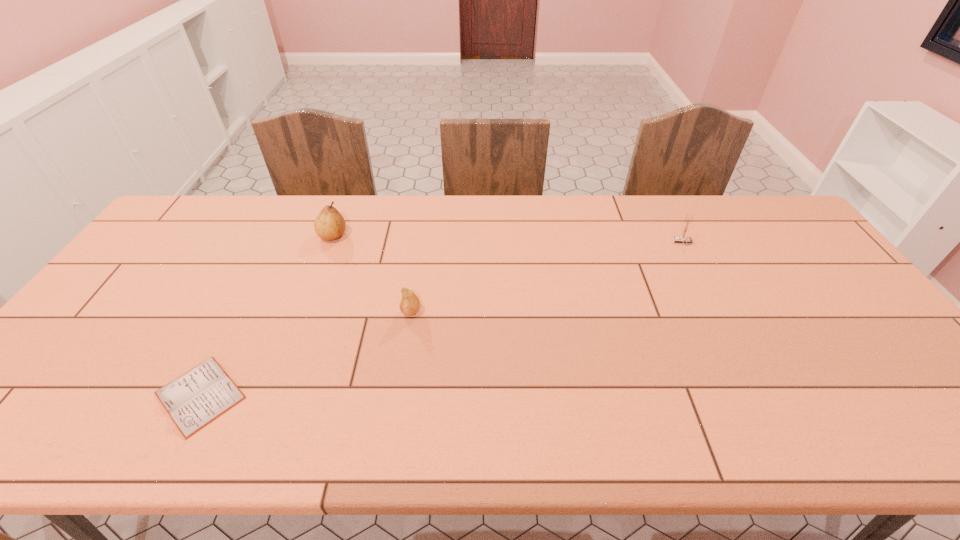
Find the location of a particular element. The width and height of the screenshot is (960, 540). free spot between the second object from right to left and the matchbox is located at coordinates (546, 276).

The width and height of the screenshot is (960, 540). Identify the location of empty space that is in between the matchbox and the diary. (442, 319).

Find the location of a particular element. The image size is (960, 540). free spot between the rightmost object and the nearer pear is located at coordinates (546, 276).

You are a GUI agent. You are given a task and a screenshot of the screen. Output one action in this format:
    pyautogui.click(x=<x>, y=<y>)
    Task: Click on the free space between the matchbox and the farther pear
    
    Given the screenshot: What is the action you would take?
    pyautogui.click(x=508, y=239)

Locate an element on the screen. The image size is (960, 540). vacant region between the matchbox and the shorter pear is located at coordinates (546, 276).

Where is `empty location between the shortest object and the matchbox`? This screenshot has height=540, width=960. empty location between the shortest object and the matchbox is located at coordinates [x=442, y=319].

I want to click on vacant area between the rightmost object and the third object from right to left, so click(x=508, y=239).

Identify the location of object that ranks as the second closest to the taller pear. The image size is (960, 540). (193, 400).

Where is `object that is the nearest to the leftmost object`? This screenshot has height=540, width=960. object that is the nearest to the leftmost object is located at coordinates (409, 305).

Identify the location of free point that satisfies the following two spatial constraints: 1. on the front side of the second object from left to right; 2. on the right side of the shorter pear. The height and width of the screenshot is (540, 960). (304, 311).